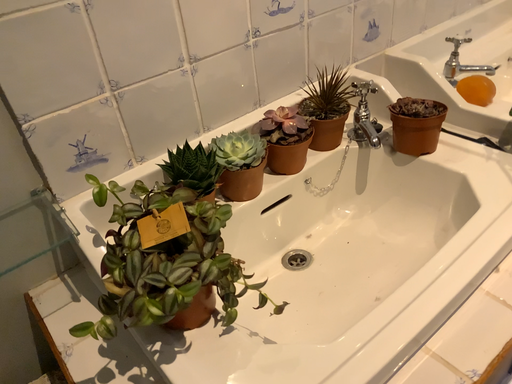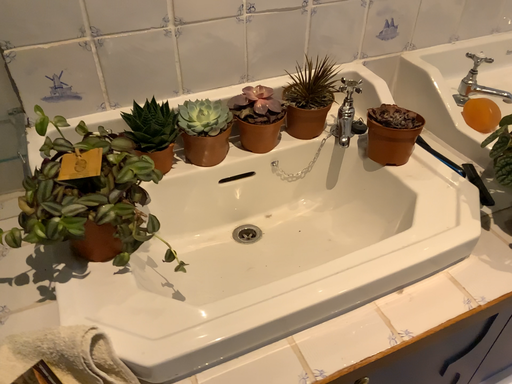
Question: How did the camera likely rotate when shooting the video?

Choices:
 (A) rotated left
 (B) rotated right

Answer: (A)